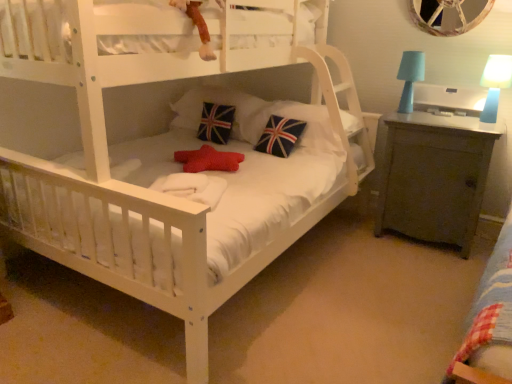
This screenshot has height=384, width=512. In order to click on vacant space situated on the left part of matte gray cabinet at right in this screenshot , I will do `click(347, 241)`.